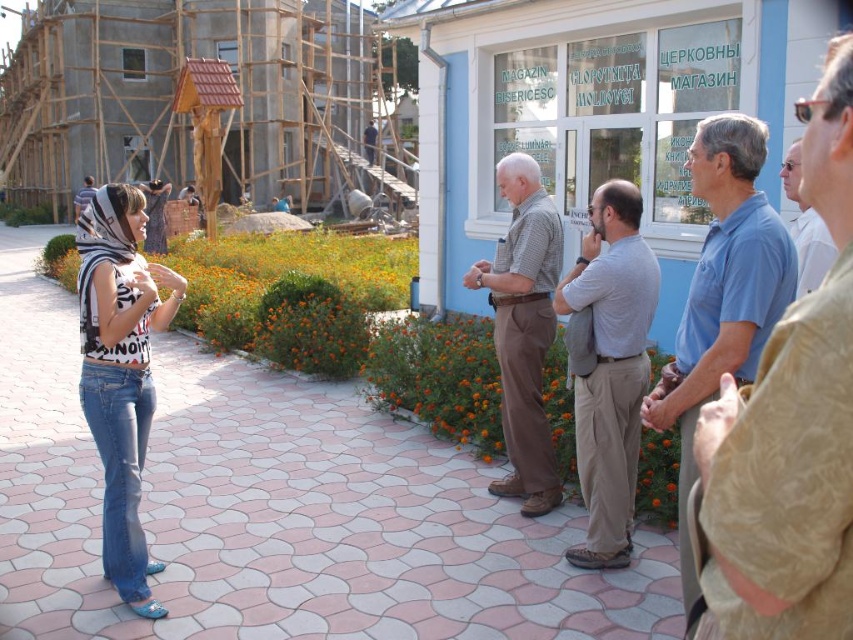
Question: Which of the following is the farthest from the observer?

Choices:
 (A) (531, 477)
 (B) (706, 392)
 (C) (131, 605)
 (D) (805, 106)

Answer: (A)

Question: Considering the relative positions of blue cotton shirt at right and checkered fabric shirt at center in the image provided, where is blue cotton shirt at right located with respect to checkered fabric shirt at center?

Choices:
 (A) below
 (B) above

Answer: (A)

Question: Can you confirm if denim jeans at left is wider than white shirt at right?

Choices:
 (A) no
 (B) yes

Answer: (A)

Question: Estimate the real-world distances between objects in this image. Which object is closer to the gray cotton shirt at center?

Choices:
 (A) denim jeans at left
 (B) blue cotton shirt at right
 (C) checkered fabric shirt at center

Answer: (C)

Question: Among these points, which one is farthest from the camera?

Choices:
 (A) (531, 468)
 (B) (793, 163)
 (C) (97, 346)

Answer: (A)

Question: Is the position of blue shirt at right more distant than that of blue cotton shirt at right?

Choices:
 (A) no
 (B) yes

Answer: (A)